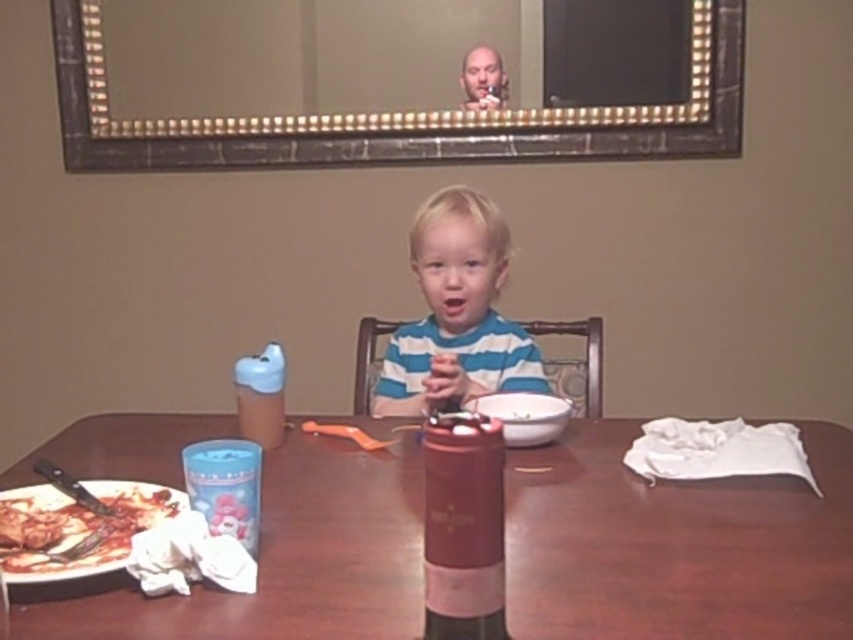
Is the position of wooden table at center less distant than that of shiny metallic pizza at lower left?

Yes, it is.

Does wooden table at center have a lesser width compared to shiny metallic pizza at lower left?

In fact, wooden table at center might be wider than shiny metallic pizza at lower left.

Is point (653, 556) less distant than point (48, 563)?

That is False.

Identify the location of wooden table at center. (675, 544).

Who is more forward, [448,564] or [125,516]?

Point [448,564] is more forward.

Is point (434, 577) less distant than point (1, 561)?

Yes, point (434, 577) is in front of point (1, 561).

Does point (456, 541) come behind point (178, 500)?

No, (456, 541) is in front of (178, 500).

Where is `matte burgundy thermos at center`? The height and width of the screenshot is (640, 853). matte burgundy thermos at center is located at coordinates (463, 528).

Between point (419, 360) and point (489, 518), which one is positioned behind?

The point (419, 360) is more distant.

Which is in front, point (421, 323) or point (492, 540)?

Point (492, 540)

Between point (503, 250) and point (451, 589), which one is positioned in front?

Positioned in front is point (451, 589).

Find the location of a particular element. The width and height of the screenshot is (853, 640). blue striped shirt at center is located at coordinates (456, 312).